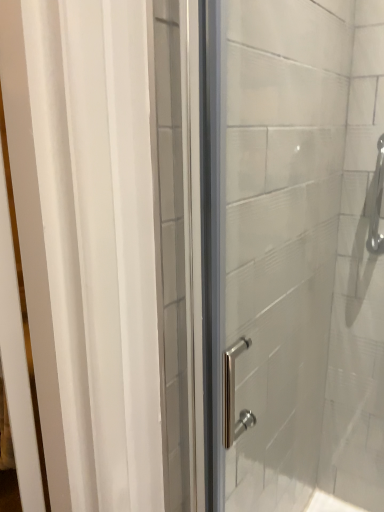
In order to face polished chrome shower handle at right, should I rotate leftwards or rightwards?

You should look right and rotate roughly 24.107 degrees.

This screenshot has width=384, height=512. Identify the location of polished chrome shower handle at right. (376, 200).

What do you see at coordinates (376, 200) in the screenshot?
I see `polished chrome shower handle at right` at bounding box center [376, 200].

You are a GUI agent. You are given a task and a screenshot of the screen. Output one action in this format:
    pyautogui.click(x=<x>, y=<y>)
    Task: Click on the polished chrome shower handle at right
    
    Given the screenshot: What is the action you would take?
    376,200